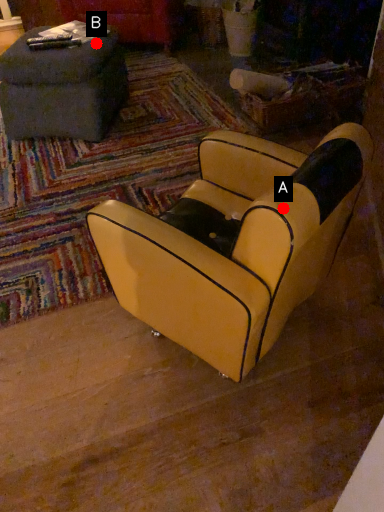
Question: Two points are circled on the image, labeled by A and B beside each circle. Which point is closer to the camera?

Choices:
 (A) A is closer
 (B) B is closer

Answer: (A)